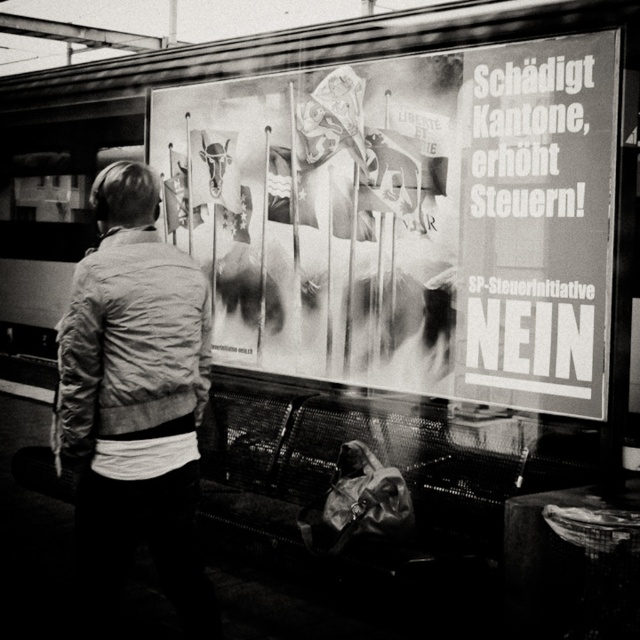
You are standing on the train station platform and want to reach the person near the poster. The person is at point (200,600). There is an obstacle at point (307,216). Can you walk directly to the person without going around the obstacle?

Point (307,216) is behind point (200,600), so you can walk directly to the person at point (200,600) without needing to go around the obstacle at point (307,216) since the obstacle is behind the target location.

You are standing at the train station platform and want to locate the black paper poster at center. According to the coordinates provided, where exactly should you look to find it?

The black paper poster at center is located at the 2D coordinates point [406,220].